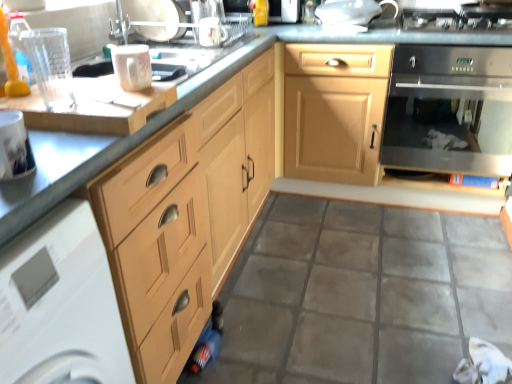
Question: Is matte wood cabinet at center positioned before porcelain glossy mug at upper center, which is counted as the third appliance, starting from the left?

Choices:
 (A) yes
 (B) no

Answer: (B)

Question: From a real-world perspective, is matte wood cabinet at center on porcelain glossy mug at upper center, the fifth appliance in the back-to-front sequence?

Choices:
 (A) yes
 (B) no

Answer: (B)

Question: Is matte wood cabinet at center oriented towards porcelain glossy mug at upper center, which ranks as the 2th appliance in front-to-back order?

Choices:
 (A) no
 (B) yes

Answer: (B)

Question: Is matte wood cabinet at center far from porcelain glossy mug at upper center, which ranks as the 2th appliance in front-to-back order?

Choices:
 (A) yes
 (B) no

Answer: (A)

Question: Would you say matte wood cabinet at center contains porcelain glossy mug at upper center, which ranks as the 2th appliance in front-to-back order?

Choices:
 (A) yes
 (B) no

Answer: (B)

Question: Does point (20, 137) appear closer or farther from the camera than point (11, 296)?

Choices:
 (A) closer
 (B) farther

Answer: (B)

Question: Relative to white glossy dishwasher at lower left, which is the second home appliance from right to left, is white glossy mug at left in front or behind?

Choices:
 (A) behind
 (B) front

Answer: (A)

Question: From a real-world perspective, relative to white glossy dishwasher at lower left, which is the second home appliance from right to left, is white glossy mug at left vertically above or below?

Choices:
 (A) above
 (B) below

Answer: (A)

Question: Based on their positions, is white glossy mug at left located to the left or right of white glossy dishwasher at lower left, marked as the first home appliance in a front-to-back arrangement?

Choices:
 (A) right
 (B) left

Answer: (A)

Question: Which is correct: stainless steel oven at right, the second home appliance when ordered from left to right, is inside black metallic gas stove at upper right, or outside of it?

Choices:
 (A) outside
 (B) inside

Answer: (A)

Question: Considering the positions of stainless steel oven at right, placed as the second home appliance when sorted from bottom to top, and black metallic gas stove at upper right in the image, is stainless steel oven at right, placed as the second home appliance when sorted from bottom to top, taller or shorter than black metallic gas stove at upper right?

Choices:
 (A) short
 (B) tall

Answer: (B)

Question: Considering their positions, is stainless steel oven at right, positioned as the 1th home appliance in back-to-front order, located in front of or behind black metallic gas stove at upper right?

Choices:
 (A) front
 (B) behind

Answer: (A)

Question: Considering the positions of stainless steel oven at right, the second home appliance when ordered from left to right, and black metallic gas stove at upper right in the image, is stainless steel oven at right, the second home appliance when ordered from left to right, wider or thinner than black metallic gas stove at upper right?

Choices:
 (A) thin
 (B) wide

Answer: (B)

Question: Is white glossy mug at upper center, the 5th appliance in the left-to-right sequence, inside or outside of black metallic gas stove at upper right?

Choices:
 (A) outside
 (B) inside

Answer: (A)

Question: Looking at the image, does white glossy mug at upper center, which is counted as the fourth appliance, starting from the back, seem bigger or smaller compared to black metallic gas stove at upper right?

Choices:
 (A) big
 (B) small

Answer: (B)